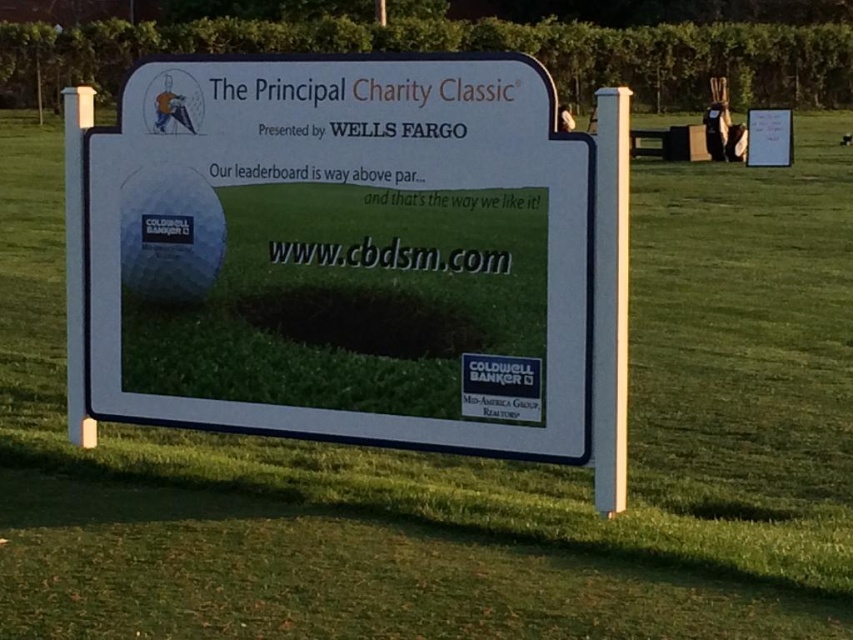
Does white plastic sign at center have a lesser width compared to yellow fabric golfer at upper left?

In fact, white plastic sign at center might be wider than yellow fabric golfer at upper left.

Is white plastic sign at center above yellow fabric golfer at upper left?

No.

The width and height of the screenshot is (853, 640). I want to click on white plastic sign at center, so click(354, 259).

You are a GUI agent. You are given a task and a screenshot of the screen. Output one action in this format:
    pyautogui.click(x=<x>, y=<y>)
    Task: Click on the white plastic sign at center
    
    Given the screenshot: What is the action you would take?
    pyautogui.click(x=354, y=259)